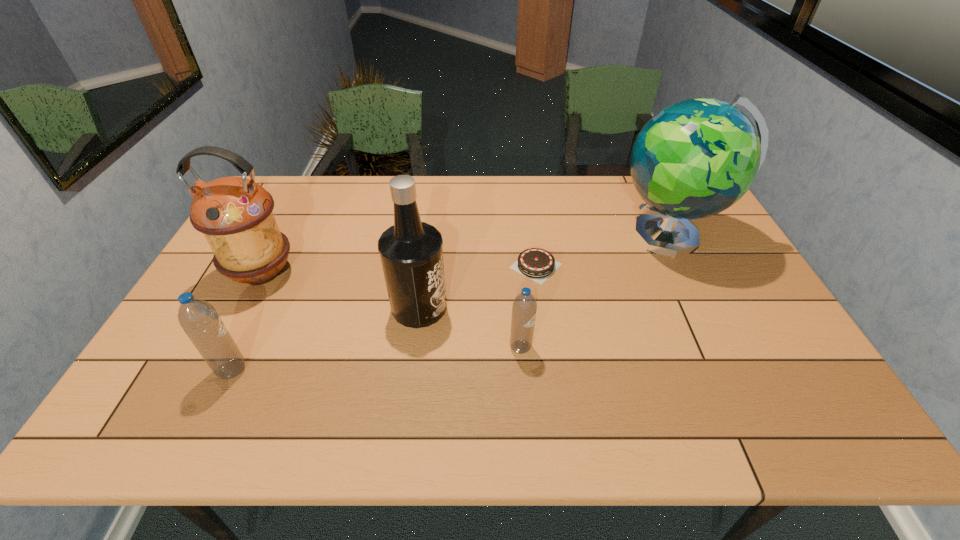
Where is `free point located on the front surface of the rightmost object`? free point located on the front surface of the rightmost object is located at coordinates (586, 237).

Identify the location of free point located 0.150m on the front surface of the rightmost object. This screenshot has width=960, height=540. (566, 237).

Locate an element on the screen. Image resolution: width=960 pixels, height=540 pixels. vacant position located 0.220m on the front surface of the rightmost object is located at coordinates (544, 237).

Identify the location of free space located on the front label of the fourth object from right to left. (552, 307).

Find the location of a particular element. Image resolution: width=960 pixels, height=540 pixels. vacant region located on the right of the oil lamp is located at coordinates (427, 273).

Where is `free space located 0.250m on the right of the chocolate cake`? Image resolution: width=960 pixels, height=540 pixels. free space located 0.250m on the right of the chocolate cake is located at coordinates (647, 266).

This screenshot has width=960, height=540. Identify the location of object at the far edge. (695, 158).

Where is `object located at the near edge`? This screenshot has width=960, height=540. object located at the near edge is located at coordinates pos(198,318).

I want to click on water bottle positioned at the left edge, so click(198, 318).

Locate an element on the screen. The width and height of the screenshot is (960, 540). oil lamp positioned at the left edge is located at coordinates (235, 214).